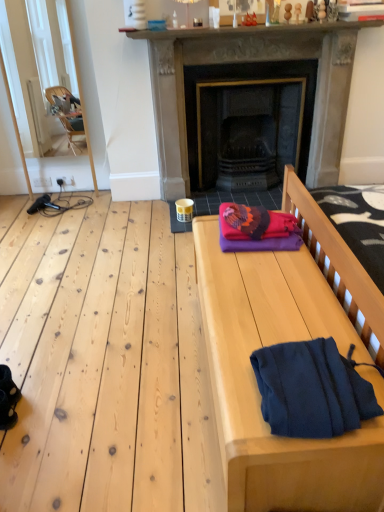
Image resolution: width=384 pixels, height=512 pixels. What are the coordinates of `knitted woolen blanket at center` in the screenshot? It's located at (254, 222).

Find the location of a particular element. This screenshot has width=384, height=512. smooth wooden bench at right is located at coordinates (257, 386).

What is the approximate height of dark blue fleece at lower right?

dark blue fleece at lower right is 3.59 inches in height.

The image size is (384, 512). I want to click on knitted woolen blanket at center, so click(x=254, y=222).

Considering the relative sizes of smooth stone mantle at upper center and dark gray stone fireplace at center in the image provided, is smooth stone mantle at upper center taller than dark gray stone fireplace at center?

No.

From the image's perspective, which one is positioned lower, smooth stone mantle at upper center or dark gray stone fireplace at center?

dark gray stone fireplace at center, from the image's perspective.

Is smooth stone mantle at upper center touching dark gray stone fireplace at center?

No, smooth stone mantle at upper center is not next to dark gray stone fireplace at center.

Is point (150, 32) closer to camera compared to point (290, 52)?

Yes, point (150, 32) is in front of point (290, 52).

Who is bigger, dark blue fleece at lower right or knitted woolen blanket at center?

dark blue fleece at lower right.

Do you think dark blue fleece at lower right is within knitted woolen blanket at center, or outside of it?

dark blue fleece at lower right is not enclosed by knitted woolen blanket at center.

Between point (352, 402) and point (279, 224), which one is positioned behind?

Positioned behind is point (279, 224).

Could you tell me if knitted woolen blanket at center is facing dark gray stone fireplace at center?

No, knitted woolen blanket at center is not oriented towards dark gray stone fireplace at center.

Which object is closer to the camera, knitted woolen blanket at center or dark gray stone fireplace at center?

knitted woolen blanket at center is closer to the camera.

From the image's perspective, relative to dark gray stone fireplace at center, is knitted woolen blanket at center above or below?

knitted woolen blanket at center is situated lower than dark gray stone fireplace at center in the image.

Is point (223, 206) closer to camera compared to point (208, 52)?

Yes, point (223, 206) is closer to viewer.

Does smooth stone mantle at upper center have a lesser width compared to smooth wooden bench at right?

Yes, smooth stone mantle at upper center is thinner than smooth wooden bench at right.

From the picture: Between smooth stone mantle at upper center and smooth wooden bench at right, which one is positioned in front?

Positioned in front is smooth wooden bench at right.

Is smooth stone mantle at upper center situated inside smooth wooden bench at right or outside?

smooth stone mantle at upper center is spatially situated outside smooth wooden bench at right.

Who is bigger, smooth stone mantle at upper center or smooth wooden bench at right?

Bigger between the two is smooth wooden bench at right.

Is smooth wooden bench at right taller than dark gray stone fireplace at center?

No.

Is smooth wooden bench at right not close to dark gray stone fireplace at center?

Yes, smooth wooden bench at right is far from dark gray stone fireplace at center.

Is smooth wooden bench at right positioned behind dark gray stone fireplace at center?

That is False.

Is smooth wooden bench at right facing towards dark gray stone fireplace at center?

No.

In the image, is knitted woolen blanket at center on the left side or the right side of smooth stone mantle at upper center?

Clearly, knitted woolen blanket at center is on the left of smooth stone mantle at upper center in the image.

From the image's perspective, is knitted woolen blanket at center above or below smooth stone mantle at upper center?

Clearly, from the image's perspective, knitted woolen blanket at center is below smooth stone mantle at upper center.

Is knitted woolen blanket at center taller or shorter than smooth stone mantle at upper center?

knitted woolen blanket at center is shorter than smooth stone mantle at upper center.

How different are the orientations of smooth stone mantle at upper center and dark blue fleece at lower right in degrees?

They differ by 90.9 degrees in their facing directions.

Between point (195, 36) and point (308, 355), which one is positioned behind?

The point (195, 36) is behind.

From their relative heights in the image, would you say smooth stone mantle at upper center is taller or shorter than dark blue fleece at lower right?

Considering their sizes, smooth stone mantle at upper center has less height than dark blue fleece at lower right.

In the scene shown: Relative to dark blue fleece at lower right, is smooth stone mantle at upper center in front or behind?

smooth stone mantle at upper center is positioned farther from the viewer than dark blue fleece at lower right.

You are a GUI agent. You are given a task and a screenshot of the screen. Output one action in this format:
    pyautogui.click(x=<x>, y=<y>)
    Task: Click on the mantle above the dark gray stone fireplace at center (from a real-world perspective)
    This screenshot has height=512, width=384.
    Given the screenshot: What is the action you would take?
    pyautogui.click(x=255, y=30)

Identify the location of bath towel that is in front of the knitted woolen blanket at center. The width and height of the screenshot is (384, 512). (312, 389).

Looking at the image, which one is located closer to dark gray stone fireplace at center, smooth stone mantle at upper center or knitted woolen blanket at center?

smooth stone mantle at upper center.

When comparing their distances from smooth wooden bench at right, does smooth stone mantle at upper center or dark gray stone fireplace at center seem further?

smooth stone mantle at upper center lies further to smooth wooden bench at right than the other object.

Looking at the image, which one is located further to dark blue fleece at lower right, knitted woolen blanket at center or smooth stone mantle at upper center?

smooth stone mantle at upper center.

When comparing their distances from dark gray stone fireplace at center, does knitted woolen blanket at center or dark blue fleece at lower right seem closer?

The object closer to dark gray stone fireplace at center is knitted woolen blanket at center.

Which object lies further to the anchor point dark blue fleece at lower right, smooth stone mantle at upper center or smooth wooden bench at right?

Among the two, smooth stone mantle at upper center is located further to dark blue fleece at lower right.

Looking at the image, which one is located closer to smooth wooden bench at right, dark blue fleece at lower right or dark gray stone fireplace at center?

Among the two, dark blue fleece at lower right is located nearer to smooth wooden bench at right.

When comparing their distances from dark gray stone fireplace at center, does knitted woolen blanket at center or smooth stone mantle at upper center seem further?

Based on the image, knitted woolen blanket at center appears to be further to dark gray stone fireplace at center.

Based on the photo, considering their positions, is dark blue fleece at lower right positioned further to dark gray stone fireplace at center than smooth stone mantle at upper center?

dark blue fleece at lower right is positioned further to the anchor dark gray stone fireplace at center.

The image size is (384, 512). I want to click on mantle between smooth wooden bench at right and dark gray stone fireplace at center along the z-axis, so click(255, 30).

Find the location of a particular element. table between smooth stone mantle at upper center and dark blue fleece at lower right from top to bottom is located at coordinates click(257, 386).

You are a GUI agent. You are given a task and a screenshot of the screen. Output one action in this format:
    pyautogui.click(x=<x>, y=<y>)
    Task: Click on the table between dark blue fleece at lower right and dark gray stone fireplace at center in the front-back direction
    This screenshot has height=512, width=384.
    Given the screenshot: What is the action you would take?
    pyautogui.click(x=257, y=386)

Locate an element on the screen. blanket between dark blue fleece at lower right and dark gray stone fireplace at center along the z-axis is located at coordinates (254, 222).